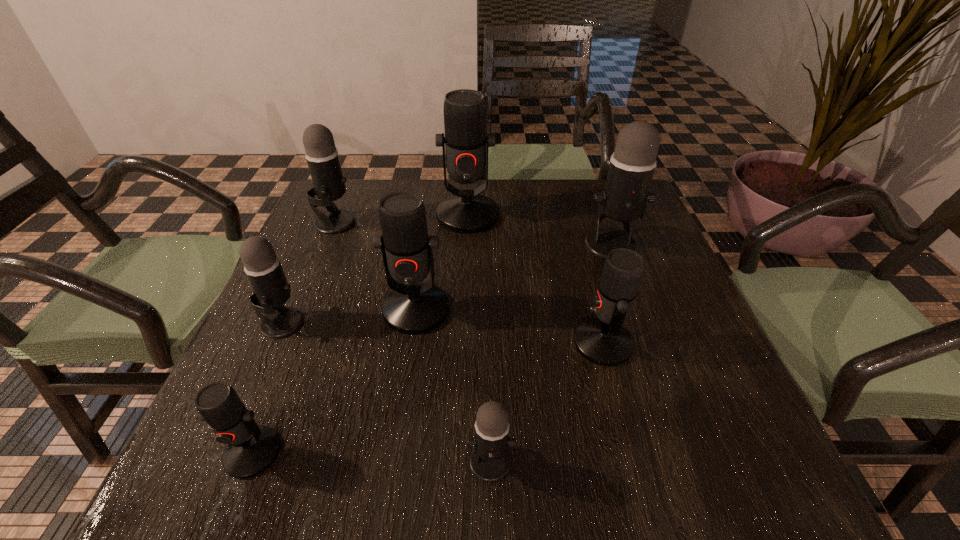
Find the location of a particular element. This screenshot has height=540, width=960. object that is at the near left corner is located at coordinates (250, 449).

Where is `blank area at the far edge`? The width and height of the screenshot is (960, 540). blank area at the far edge is located at coordinates (x=540, y=222).

Image resolution: width=960 pixels, height=540 pixels. I want to click on vacant region at the left edge of the desktop, so click(x=297, y=276).

Where is `free region at the right edge of the desktop`? The width and height of the screenshot is (960, 540). free region at the right edge of the desktop is located at coordinates (650, 379).

Identify the location of free space at the far left corner. Image resolution: width=960 pixels, height=540 pixels. (370, 217).

Locate an element on the screen. The width and height of the screenshot is (960, 540). vacant space at the near left corner of the desktop is located at coordinates (208, 444).

The width and height of the screenshot is (960, 540). In order to click on vacant area between the rightmost gray microphone and the smallest red microphone in this screenshot , I will do `click(432, 349)`.

Find the location of a particular element. This screenshot has height=540, width=960. free area in between the second nearest gray microphone and the smallest gray microphone is located at coordinates [387, 392].

I want to click on vacant region between the second biggest gray microphone and the nearest red microphone, so click(294, 338).

What are the coordinates of `free space between the second biggest gray microphone and the rightmost gray microphone` in the screenshot? It's located at (473, 234).